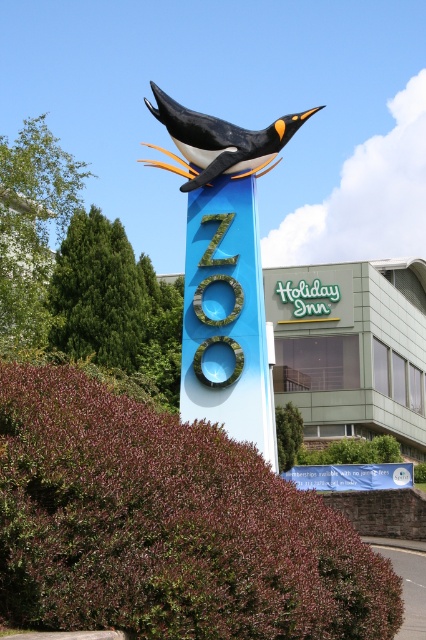
Can you confirm if matte blue penguin at center is positioned to the right of blue fabric banner at center?

Incorrect, matte blue penguin at center is not on the right side of blue fabric banner at center.

Identify the location of matte blue penguin at center. (224, 269).

What do you see at coordinates (224, 269) in the screenshot? I see `matte blue penguin at center` at bounding box center [224, 269].

Locate an element on the screen. matte blue penguin at center is located at coordinates (224, 269).

The image size is (426, 640). What do you see at coordinates (226, 317) in the screenshot?
I see `blue painted wood sign at center` at bounding box center [226, 317].

Is blue painted wood sign at center closer to camera compared to blue fabric banner at center?

Yes, it is in front of blue fabric banner at center.

Is point (216, 356) farther from camera compared to point (333, 483)?

That is False.

Identify the location of blue painted wood sign at center. (226, 317).

Who is lower down, blue painted wood sign at center or polished blue penguin at center?

Positioned lower is blue painted wood sign at center.

Is point (261, 326) less distant than point (255, 148)?

Yes, it is.

Which is behind, point (210, 224) or point (262, 161)?

Positioned behind is point (262, 161).

Locate an element on the screen. blue painted wood sign at center is located at coordinates (226, 317).